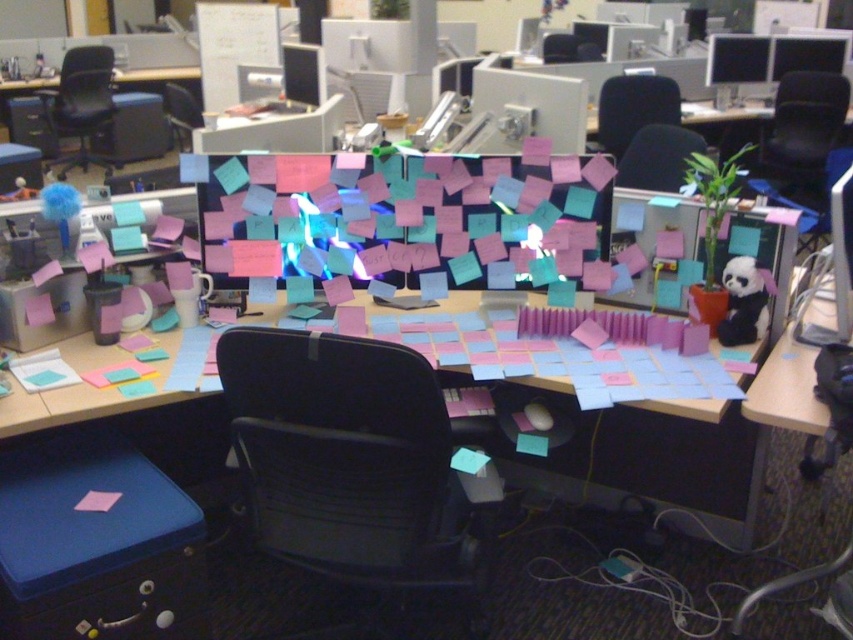
Who is shorter, black fabric chair at upper right or black plastic chair at upper left?

black fabric chair at upper right

Who is lower down, black fabric chair at upper right or black plastic chair at upper left?

black fabric chair at upper right

Where is `black fabric chair at upper right`? This screenshot has height=640, width=853. black fabric chair at upper right is located at coordinates (804, 129).

Measure the distance between black fabric chair at upper right and camera.

The distance of black fabric chair at upper right from camera is 15.22 feet.

Which is behind, point (815, 179) or point (616, 122)?

Point (815, 179)

This screenshot has width=853, height=640. In order to click on black fabric chair at upper right in this screenshot , I will do `click(804, 129)`.

Consider the image. Can you confirm if black mesh swivel chair at center is shorter than pink matte paper at center?

Incorrect, black mesh swivel chair at center's height does not fall short of pink matte paper at center's.

This screenshot has width=853, height=640. What do you see at coordinates (354, 465) in the screenshot? I see `black mesh swivel chair at center` at bounding box center [354, 465].

Locate an element on the screen. This screenshot has width=853, height=640. black mesh swivel chair at center is located at coordinates pos(354,465).